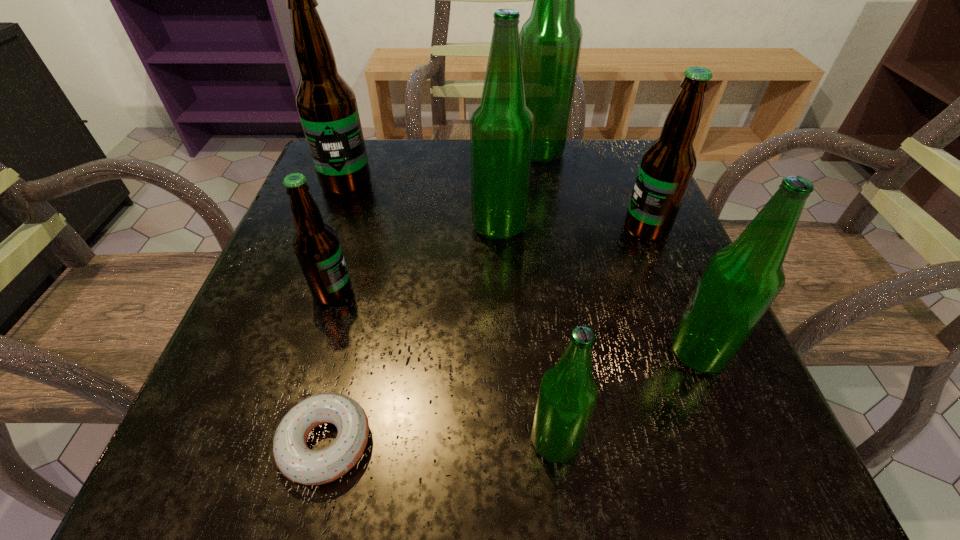
The image size is (960, 540). I want to click on free area in between the tallest beer bottle and the second nearest brown beer bottle, so click(592, 191).

The width and height of the screenshot is (960, 540). I want to click on empty location between the doughnut and the tallest beer bottle, so click(x=432, y=298).

This screenshot has width=960, height=540. Find the location of `object that ranks as the sixth closest to the nearest beer bottle`. object that ranks as the sixth closest to the nearest beer bottle is located at coordinates (326, 104).

Identify which object is the sixth nearest to the third nearest green beer bottle. Please provide its 2D coordinates. Your answer should be formatted as a tuple, i.e. [(x, y)], where the tuple contains the x and y coordinates of a point satisfying the conditions above.

[(294, 459)]

The height and width of the screenshot is (540, 960). I want to click on beer bottle that is the fourth closest one to the second smallest brown beer bottle, so click(x=567, y=397).

Locate an element on the screen. the fourth closest beer bottle relative to the second smallest brown beer bottle is located at coordinates (567, 397).

I want to click on green beer bottle that is the closest to the smallest green beer bottle, so pyautogui.click(x=741, y=281).

Select which green beer bottle is the third closest to the smallest green beer bottle. Please provide its 2D coordinates. Your answer should be formatted as a tuple, i.e. [(x, y)], where the tuple contains the x and y coordinates of a point satisfying the conditions above.

[(551, 38)]

Locate which brown beer bottle is the second closest to the tallest beer bottle. Please provide its 2D coordinates. Your answer should be formatted as a tuple, i.e. [(x, y)], where the tuple contains the x and y coordinates of a point satisfying the conditions above.

[(326, 104)]

You are a GUI agent. You are given a task and a screenshot of the screen. Output one action in this format:
    pyautogui.click(x=<x>, y=<y>)
    Task: Click on the closest brown beer bottle to the nearest beer bottle
    This screenshot has width=960, height=540.
    Given the screenshot: What is the action you would take?
    pyautogui.click(x=316, y=245)